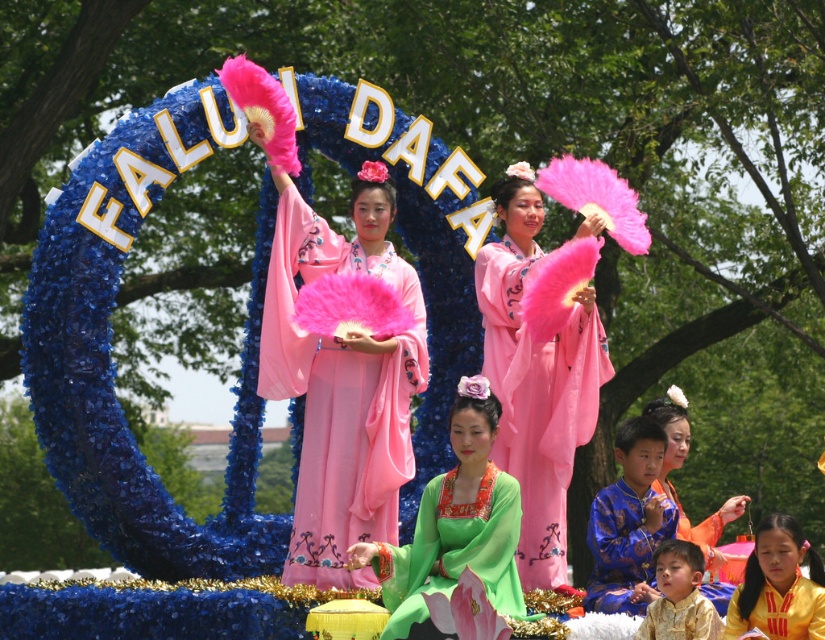
You are standing at the origin point of the coordinate system in the image. The origin is at the bottom left corner of the image. You want to locate the matte pink silk kimono at center. What are its coordinates?

The coordinates of the matte pink silk kimono at center are at point [342,385].

You are standing in the parade area and want to determine which of the two points, point (266, 368) or point (482, 250), is closer to you. Based on the scene description, which point is nearer?

Point (266, 368) is closer to the viewer than point (482, 250).